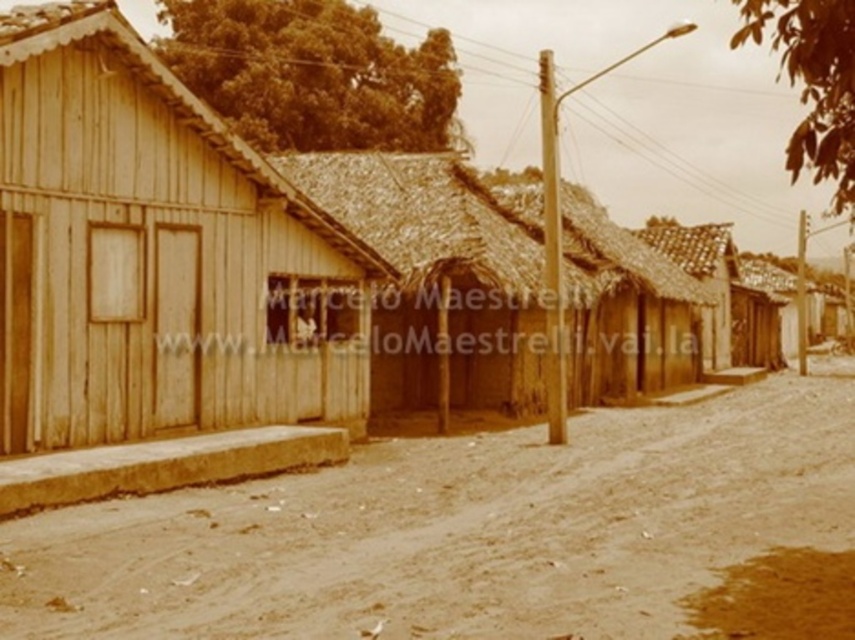
Question: Which of these objects is positioned closest to the brown wooden hut at center?

Choices:
 (A) brown sandy dirt field at center
 (B) wooden hut at left
 (C) thatched roof hut at center

Answer: (C)

Question: Can you confirm if wooden hut at left is bigger than brown wooden hut at center?

Choices:
 (A) no
 (B) yes

Answer: (A)

Question: In this image, where is thatched roof hut at center located relative to brown wooden hut at center?

Choices:
 (A) below
 (B) above

Answer: (A)

Question: Which object is farther from the camera taking this photo?

Choices:
 (A) brown wooden hut at center
 (B) thatched roof hut at center

Answer: (A)

Question: Observing the image, what is the correct spatial positioning of brown sandy dirt field at center in reference to thatched roof hut at center?

Choices:
 (A) above
 (B) below

Answer: (B)

Question: Which of the following is the closest to the observer?

Choices:
 (A) (34, 420)
 (B) (679, 282)
 (C) (783, 465)

Answer: (A)